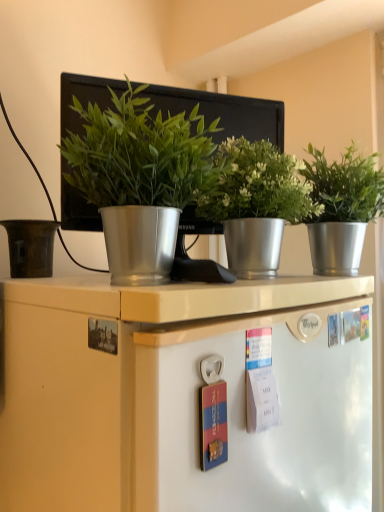
What do you see at coordinates (255, 203) in the screenshot? I see `metallic silver pot at center, which is counted as the second houseplant, starting from the right` at bounding box center [255, 203].

At what (x,y) coordinates should I click in order to perform the action: click on silver metallic pot at right, which is counted as the 1th houseplant, starting from the right. Please return your answer as a coordinate pair (x, y). Looking at the image, I should click on (342, 208).

You are a GUI agent. You are given a task and a screenshot of the screen. Output one action in this format:
    pyautogui.click(x=<x>, y=<y>)
    Task: Click on the green metallic plant pot at center, the first houseplant positioned from the left
    Image resolution: width=384 pixels, height=512 pixels.
    Given the screenshot: What is the action you would take?
    pyautogui.click(x=138, y=153)

Is green metallic plant pot at center, the first houseplant positioned from the left, turned away from silver metallic pot at right, which is counted as the 1th houseplant, starting from the right?

green metallic plant pot at center, the first houseplant positioned from the left, is not turned away from silver metallic pot at right, which is counted as the 1th houseplant, starting from the right.

Between green metallic plant pot at center, the first houseplant positioned from the left, and silver metallic pot at right, which is counted as the 1th houseplant, starting from the right, which one has smaller width?

green metallic plant pot at center, the first houseplant positioned from the left.

Does point (93, 127) come closer to viewer compared to point (374, 182)?

Yes, it is in front of point (374, 182).

From the image's perspective, who appears lower, green metallic plant pot at center, the first houseplant positioned from the left, or silver metallic pot at right, which is the 3th houseplant in left-to-right order?

silver metallic pot at right, which is the 3th houseplant in left-to-right order, from the image's perspective.

Is matte brown pot at left to the left of silver metallic pot at right, which is the 3th houseplant in left-to-right order, from the viewer's perspective?

Yes, matte brown pot at left is to the left of silver metallic pot at right, which is the 3th houseplant in left-to-right order.

Considering the sizes of objects matte brown pot at left and silver metallic pot at right, which is counted as the 1th houseplant, starting from the right, in the image provided, who is taller, matte brown pot at left or silver metallic pot at right, which is counted as the 1th houseplant, starting from the right,?

silver metallic pot at right, which is counted as the 1th houseplant, starting from the right, is taller.

Is matte brown pot at left outside of silver metallic pot at right, which is counted as the 1th houseplant, starting from the right?

Indeed, matte brown pot at left is completely outside silver metallic pot at right, which is counted as the 1th houseplant, starting from the right.

Is matte brown pot at left wider or thinner than silver metallic pot at right, which is the 3th houseplant in left-to-right order?

In the image, matte brown pot at left appears to be more narrow than silver metallic pot at right, which is the 3th houseplant in left-to-right order.

Between metallic silver pot at center, the 2th houseplant viewed from the left, and silver metallic pot at right, which is counted as the 1th houseplant, starting from the right, which one has less height?

Standing shorter between the two is metallic silver pot at center, the 2th houseplant viewed from the left.

Is metallic silver pot at center, which is counted as the second houseplant, starting from the right, completely or partially outside of silver metallic pot at right, which is counted as the 1th houseplant, starting from the right?

Yes, metallic silver pot at center, which is counted as the second houseplant, starting from the right, is outside of silver metallic pot at right, which is counted as the 1th houseplant, starting from the right.

Looking at the image, does metallic silver pot at center, the 2th houseplant viewed from the left, seem bigger or smaller compared to silver metallic pot at right, which is the 3th houseplant in left-to-right order?

Clearly, metallic silver pot at center, the 2th houseplant viewed from the left, is smaller in size than silver metallic pot at right, which is the 3th houseplant in left-to-right order.

Which object is further away from the camera, metallic silver pot at center, which is counted as the second houseplant, starting from the right, or silver metallic pot at right, which is the 3th houseplant in left-to-right order?

silver metallic pot at right, which is the 3th houseplant in left-to-right order.

Is silver metallic pot at right, which is counted as the 1th houseplant, starting from the right, outside of metallic silver pot at center, the 2th houseplant viewed from the left?

silver metallic pot at right, which is counted as the 1th houseplant, starting from the right, is positioned outside metallic silver pot at center, the 2th houseplant viewed from the left.

Considering the positions of objects silver metallic pot at right, which is the 3th houseplant in left-to-right order, and metallic silver pot at center, the 2th houseplant viewed from the left, in the image provided, who is behind, silver metallic pot at right, which is the 3th houseplant in left-to-right order, or metallic silver pot at center, the 2th houseplant viewed from the left,?

silver metallic pot at right, which is the 3th houseplant in left-to-right order.

Who is smaller, silver metallic pot at right, which is counted as the 1th houseplant, starting from the right, or metallic silver pot at center, the 2th houseplant viewed from the left?

metallic silver pot at center, the 2th houseplant viewed from the left.

Is silver metallic pot at right, which is counted as the 1th houseplant, starting from the right, far from metallic silver pot at center, the 2th houseplant viewed from the left?

No, silver metallic pot at right, which is counted as the 1th houseplant, starting from the right, is in close proximity to metallic silver pot at center, the 2th houseplant viewed from the left.

In the scene shown: Which object is closer to the camera, green metallic plant pot at center, which is the third houseplant in right-to-left order, or matte brown pot at left?

green metallic plant pot at center, which is the third houseplant in right-to-left order.

Can you confirm if green metallic plant pot at center, the first houseplant positioned from the left, is shorter than matte brown pot at left?

No, green metallic plant pot at center, the first houseplant positioned from the left, is not shorter than matte brown pot at left.

Based on their positions, is green metallic plant pot at center, which is the third houseplant in right-to-left order, located to the left or right of matte brown pot at left?

From the image, it's evident that green metallic plant pot at center, which is the third houseplant in right-to-left order, is to the right of matte brown pot at left.

From the image's perspective, is green metallic plant pot at center, which is the third houseplant in right-to-left order, positioned above or below matte brown pot at left?

Clearly, from the image's perspective, green metallic plant pot at center, which is the third houseplant in right-to-left order, is above matte brown pot at left.

Would you consider silver metallic pot at right, which is the 3th houseplant in left-to-right order, to be distant from matte brown pot at left?

silver metallic pot at right, which is the 3th houseplant in left-to-right order, is near matte brown pot at left, not far away.

Is silver metallic pot at right, which is counted as the 1th houseplant, starting from the right, thinner than matte brown pot at left?

No.

Is silver metallic pot at right, which is the 3th houseplant in left-to-right order, taller or shorter than matte brown pot at left?

Considering their sizes, silver metallic pot at right, which is the 3th houseplant in left-to-right order, has more height than matte brown pot at left.

Which of these two, silver metallic pot at right, which is the 3th houseplant in left-to-right order, or matte brown pot at left, is smaller?

With smaller size is matte brown pot at left.

Does silver metallic pot at right, which is counted as the 1th houseplant, starting from the right, have a smaller size compared to green metallic plant pot at center, the first houseplant positioned from the left?

Actually, silver metallic pot at right, which is counted as the 1th houseplant, starting from the right, might be larger than green metallic plant pot at center, the first houseplant positioned from the left.

From the image's perspective, is silver metallic pot at right, which is counted as the 1th houseplant, starting from the right, located beneath green metallic plant pot at center, which is the third houseplant in right-to-left order?

Yes.

Which object is more forward, silver metallic pot at right, which is the 3th houseplant in left-to-right order, or green metallic plant pot at center, which is the third houseplant in right-to-left order?

Positioned in front is green metallic plant pot at center, which is the third houseplant in right-to-left order.

In terms of height, does silver metallic pot at right, which is counted as the 1th houseplant, starting from the right, look taller or shorter compared to green metallic plant pot at center, the first houseplant positioned from the left?

Considering their sizes, silver metallic pot at right, which is counted as the 1th houseplant, starting from the right, has more height than green metallic plant pot at center, the first houseplant positioned from the left.

Where is `houseplant that is above the silver metallic pot at right, which is counted as the 1th houseplant, starting from the right (from the image's perspective)`? houseplant that is above the silver metallic pot at right, which is counted as the 1th houseplant, starting from the right (from the image's perspective) is located at coordinates (138, 153).

You are a GUI agent. You are given a task and a screenshot of the screen. Output one action in this format:
    pyautogui.click(x=<x>, y=<y>)
    Task: Click on the houseplant that is the 3rd one when counting rightward from the matte brown pot at left
    
    Given the screenshot: What is the action you would take?
    342,208

Which object lies nearer to the anchor point metallic silver pot at center, which is counted as the second houseplant, starting from the right, matte brown pot at left or green metallic plant pot at center, which is the third houseplant in right-to-left order?

Based on the image, green metallic plant pot at center, which is the third houseplant in right-to-left order, appears to be nearer to metallic silver pot at center, which is counted as the second houseplant, starting from the right.

When comparing their distances from matte brown pot at left, does green metallic plant pot at center, the first houseplant positioned from the left, or silver metallic pot at right, which is counted as the 1th houseplant, starting from the right, seem further?

silver metallic pot at right, which is counted as the 1th houseplant, starting from the right, lies further to matte brown pot at left than the other object.

Considering their positions, is silver metallic pot at right, which is the 3th houseplant in left-to-right order, positioned closer to metallic silver pot at center, which is counted as the second houseplant, starting from the right, than green metallic plant pot at center, which is the third houseplant in right-to-left order?

The object closer to metallic silver pot at center, which is counted as the second houseplant, starting from the right, is silver metallic pot at right, which is the 3th houseplant in left-to-right order.

From the image, which object appears to be nearer to green metallic plant pot at center, the first houseplant positioned from the left, metallic silver pot at center, the 2th houseplant viewed from the left, or silver metallic pot at right, which is counted as the 1th houseplant, starting from the right?

metallic silver pot at center, the 2th houseplant viewed from the left, is positioned closer to the anchor green metallic plant pot at center, the first houseplant positioned from the left.

Looking at the image, which one is located closer to green metallic plant pot at center, the first houseplant positioned from the left, silver metallic pot at right, which is the 3th houseplant in left-to-right order, or metallic silver pot at center, which is counted as the second houseplant, starting from the right?

Among the two, metallic silver pot at center, which is counted as the second houseplant, starting from the right, is located nearer to green metallic plant pot at center, the first houseplant positioned from the left.

Based on their spatial positions, is green metallic plant pot at center, the first houseplant positioned from the left, or metallic silver pot at center, which is counted as the second houseplant, starting from the right, closer to matte brown pot at left?

green metallic plant pot at center, the first houseplant positioned from the left.

Based on their spatial positions, is metallic silver pot at center, which is counted as the second houseplant, starting from the right, or green metallic plant pot at center, the first houseplant positioned from the left, further from silver metallic pot at right, which is the 3th houseplant in left-to-right order?

The object further to silver metallic pot at right, which is the 3th houseplant in left-to-right order, is green metallic plant pot at center, the first houseplant positioned from the left.

Considering their positions, is green metallic plant pot at center, the first houseplant positioned from the left, positioned closer to silver metallic pot at right, which is the 3th houseplant in left-to-right order, than matte brown pot at left?

Based on the image, green metallic plant pot at center, the first houseplant positioned from the left, appears to be nearer to silver metallic pot at right, which is the 3th houseplant in left-to-right order.

The height and width of the screenshot is (512, 384). I want to click on houseplant located between green metallic plant pot at center, the first houseplant positioned from the left, and silver metallic pot at right, which is the 3th houseplant in left-to-right order, in the left-right direction, so click(x=255, y=203).

Where is `houseplant located between matte brown pot at left and metallic silver pot at center, the 2th houseplant viewed from the left, in the left-right direction`? houseplant located between matte brown pot at left and metallic silver pot at center, the 2th houseplant viewed from the left, in the left-right direction is located at coordinates (138, 153).